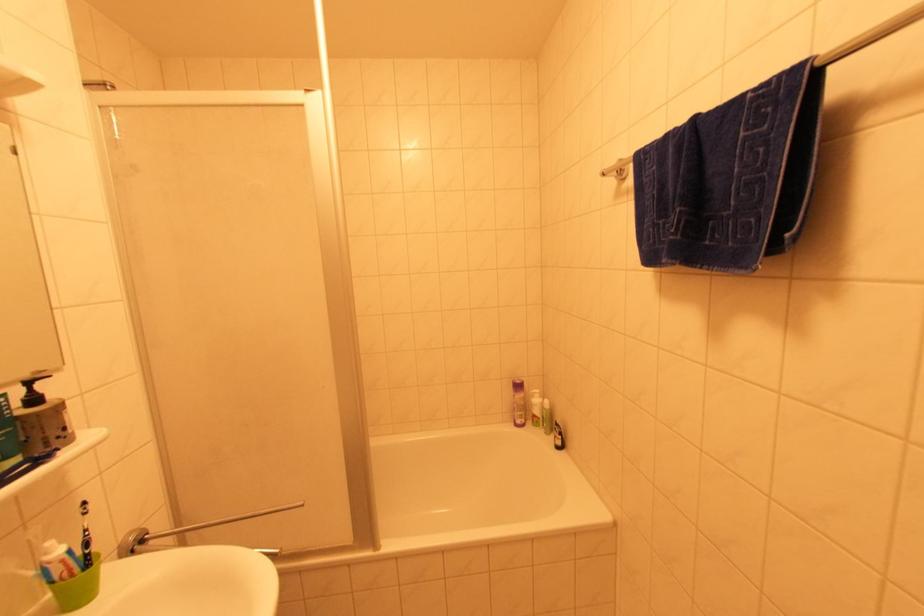
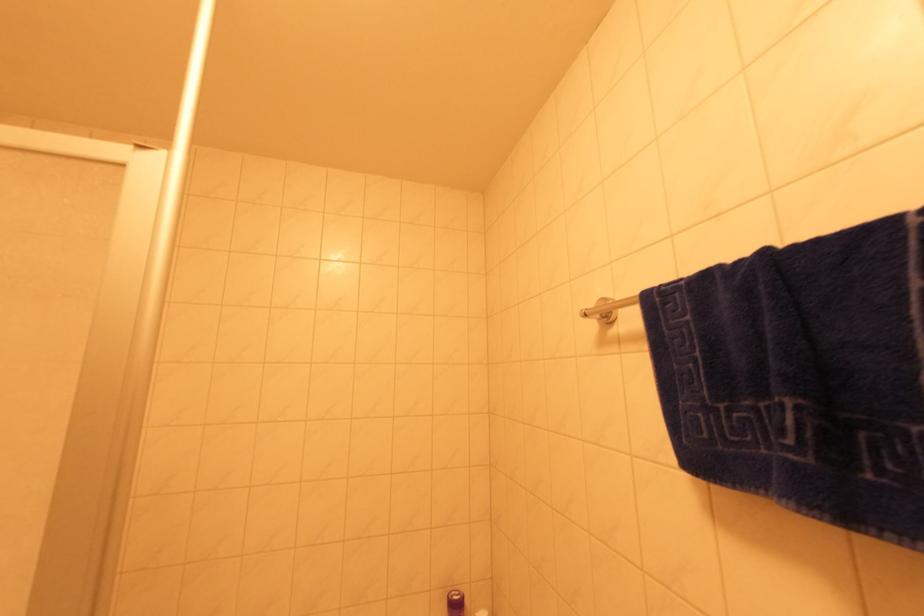
Question: The images are taken continuously from a first-person perspective. In which direction is your viewpoint rotating?

Choices:
 (A) Left
 (B) Right
 (C) Up
 (D) Down

Answer: (C)